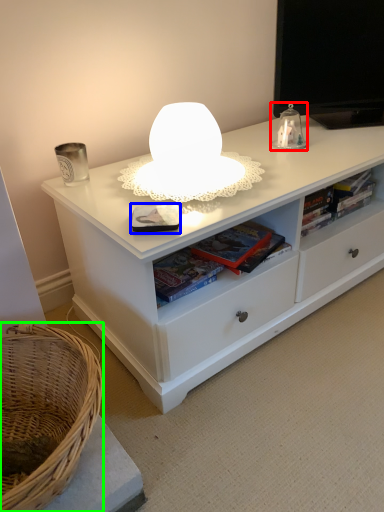
Question: Considering the real-world distances, which object is closest to table lamp (highlighted by a red box)? paperback book (highlighted by a blue box) or basket (highlighted by a green box).

Choices:
 (A) paperback book
 (B) basket

Answer: (A)